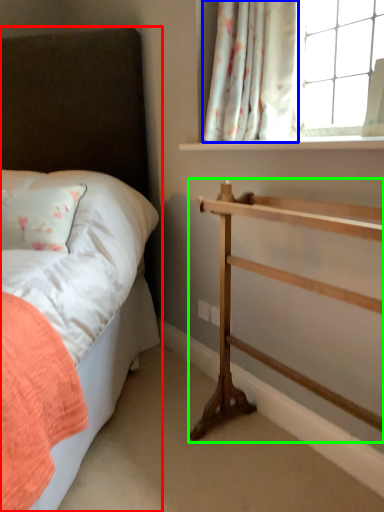
Question: Which object is the farthest from bed (highlighted by a red box)? Choose among these: curtain (highlighted by a blue box) or shelf (highlighted by a green box).

Choices:
 (A) curtain
 (B) shelf

Answer: (B)